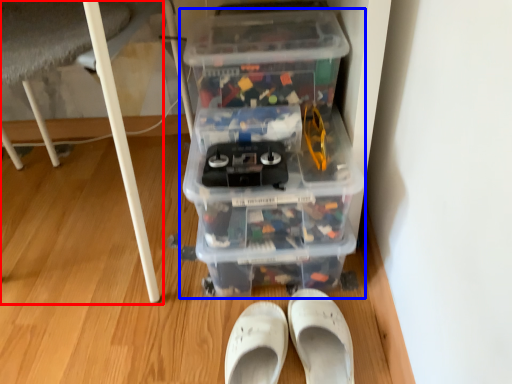
Question: Which object appears closest to the camera in this image, furniture (highlighted by a red box) or storage box (highlighted by a blue box)?

Choices:
 (A) furniture
 (B) storage box

Answer: (A)